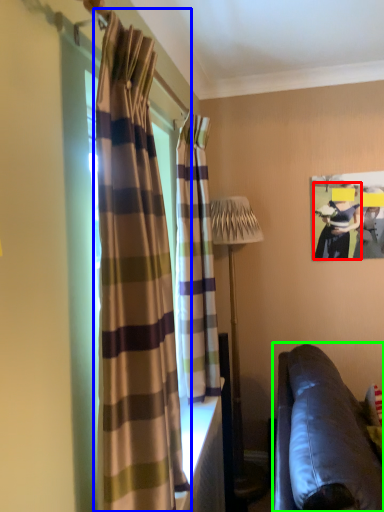
Question: Based on their relative distances, which object is farther from person (highlighted by a red box)? Choose from curtain (highlighted by a blue box) and studio couch (highlighted by a green box).

Choices:
 (A) curtain
 (B) studio couch

Answer: (A)